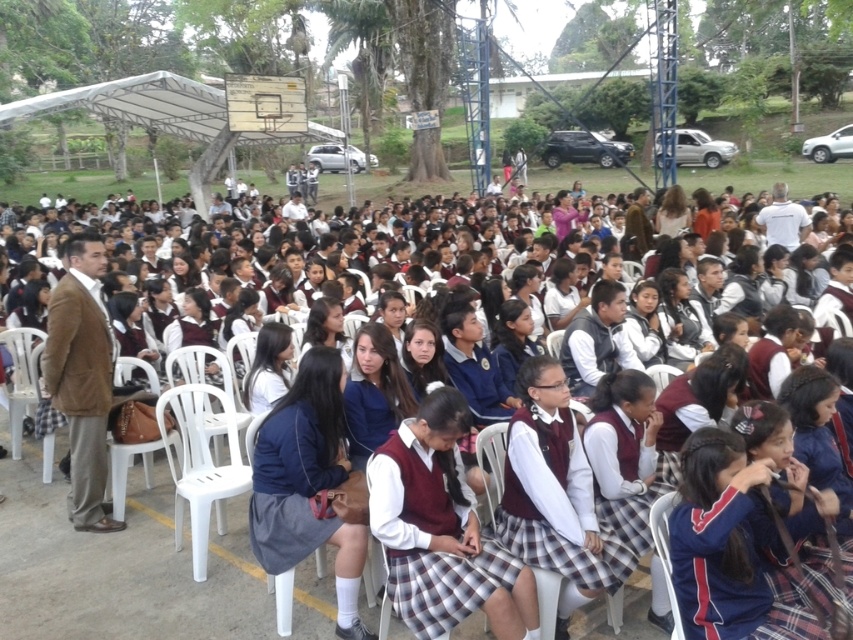
You are organizing a school event and need to ensure there is enough space between the maroon uniformed students at center and the white plastic chair at center. Based on the image, can you determine if the students are wider than the chair?

The maroon uniformed students at center might be wider than the white plastic chair at center, so there may not be enough space between them. You should check the actual measurements to confirm.

Based on the photo, you are standing at the edge of the outdoor gathering area and want to take a photo of the maroon uniformed students at center and the white plastic chair at lower right. Which object is closer to you?

The maroon uniformed students at center are closer to you because they are positioned further to the viewer than the white plastic chair at lower right, meaning they appear nearer in the scene.

You are standing in the middle of the outdoor gathering area and want to walk towards both the point at coordinates (181, 528) and the point at (670, 497). Which point will you reach first?

You will reach the point at coordinates (181, 528) first because it is closer to you than the point at (670, 497), which is further away.